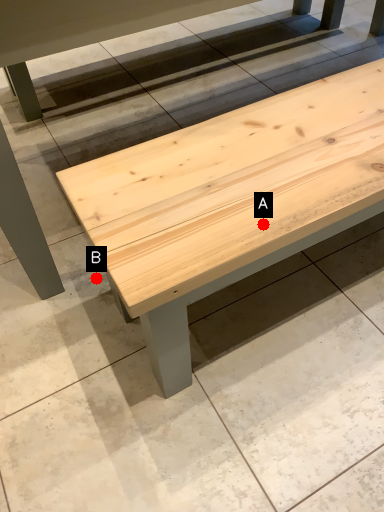
Question: Two points are circled on the image, labeled by A and B beside each circle. Which of the following is the farthest from the observer?

Choices:
 (A) A is further
 (B) B is further

Answer: (B)